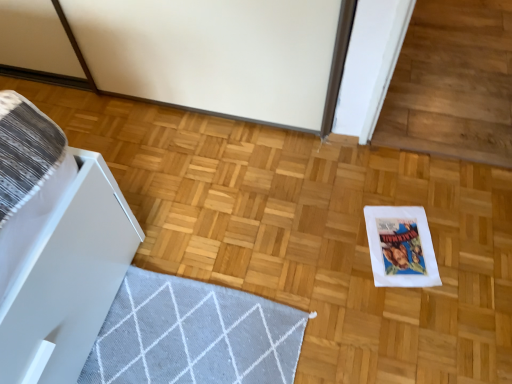
At what (x,y) coordinates should I click in order to perform the action: click on vacant space to the left of matte white comic book at lower right. Please return your answer as a coordinate pair (x, y). This screenshot has height=384, width=512. Looking at the image, I should click on (335, 250).